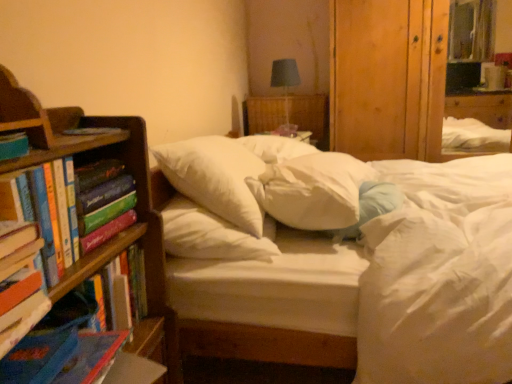
Question: From a real-world perspective, is wooden bookshelf at left physically above white soft pillow at center, placed as the 2th pillow when sorted from left to right?

Choices:
 (A) no
 (B) yes

Answer: (A)

Question: From the image's perspective, is wooden bookshelf at left on white soft pillow at center, placed as the 2th pillow when sorted from left to right?

Choices:
 (A) no
 (B) yes

Answer: (A)

Question: From a real-world perspective, is wooden bookshelf at left under white soft pillow at center, the second pillow positioned from the right?

Choices:
 (A) yes
 (B) no

Answer: (A)

Question: Considering the relative sizes of wooden bookshelf at left and white soft pillow at center, placed as the 2th pillow when sorted from left to right, in the image provided, is wooden bookshelf at left taller than white soft pillow at center, placed as the 2th pillow when sorted from left to right,?

Choices:
 (A) yes
 (B) no

Answer: (A)

Question: Can you confirm if wooden bookshelf at left is positioned to the right of white soft pillow at center, placed as the 2th pillow when sorted from left to right?

Choices:
 (A) yes
 (B) no

Answer: (B)

Question: From the image's perspective, is wooden bookshelf at left below white soft pillow at center, placed as the 2th pillow when sorted from left to right?

Choices:
 (A) no
 (B) yes

Answer: (B)

Question: Is hardcover book at left, placed as the 4th book when sorted from back to front, at the left side of white soft pillow at center, which is the third pillow from right to left?

Choices:
 (A) yes
 (B) no

Answer: (A)

Question: Is hardcover book at left, positioned as the first book in front-to-back order, bigger than white soft pillow at center, which is the third pillow from right to left?

Choices:
 (A) no
 (B) yes

Answer: (A)

Question: From a real-world perspective, is hardcover book at left, placed as the 4th book when sorted from back to front, positioned under white soft pillow at center, which is the third pillow from right to left, based on gravity?

Choices:
 (A) no
 (B) yes

Answer: (A)

Question: From the image's perspective, is hardcover book at left, positioned as the first book in front-to-back order, below white soft pillow at center, the first pillow in the left-to-right sequence?

Choices:
 (A) yes
 (B) no

Answer: (A)

Question: Does hardcover book at left, positioned as the first book in front-to-back order, have a smaller size compared to white soft pillow at center, which is the third pillow from right to left?

Choices:
 (A) yes
 (B) no

Answer: (A)

Question: Is hardcover book at left, positioned as the first book in front-to-back order, facing towards white soft pillow at center, the first pillow in the left-to-right sequence?

Choices:
 (A) yes
 (B) no

Answer: (B)

Question: Is white soft pillow at center, which is the third pillow from right to left, inside matte blue book at left, positioned as the 2th book in front-to-back order?

Choices:
 (A) no
 (B) yes

Answer: (A)